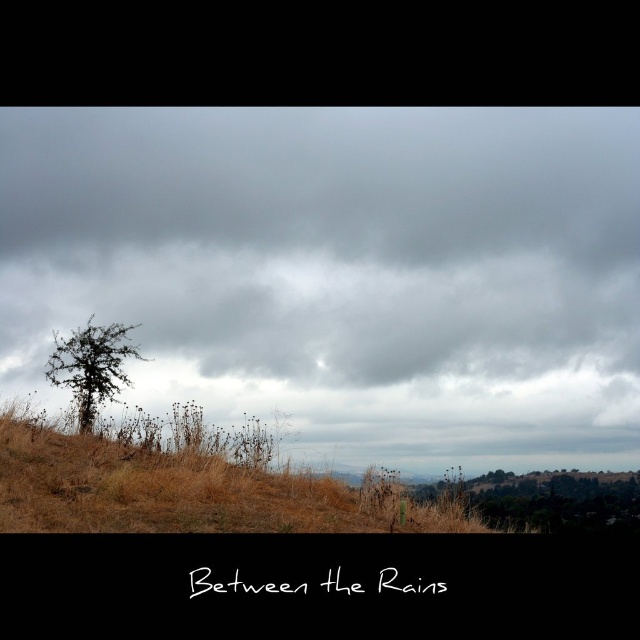
You are an environmental scientist assessing the landscape. You observe the brown grassy tree at lower right and the brown textured tree at center. Based on their positions, which tree is closer to the ground?

The brown grassy tree at lower right is closer to the ground because it is positioned below the brown textured tree at center.

You are an observer standing on the dry grassy hillside. Looking at the scene, which object is positioned higher in the image between the gray cloudy sky at upper center and the brown textured tree at center?

The gray cloudy sky at upper center is positioned higher than the brown textured tree at center in the image.